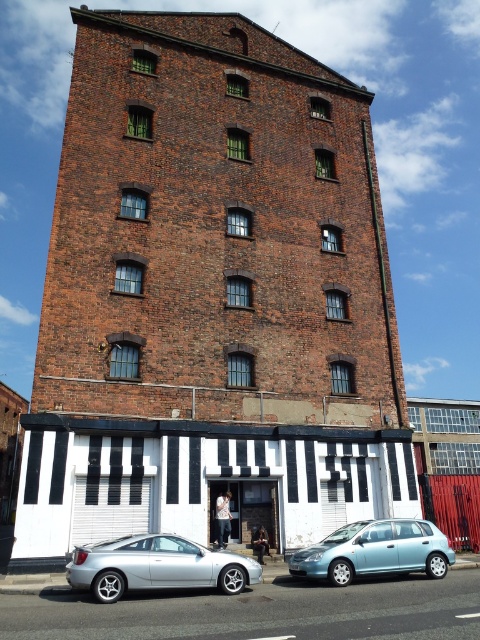
Question: Is silver metallic car at lower left bigger than light blue metallic hatchback at lower right?

Choices:
 (A) yes
 (B) no

Answer: (A)

Question: Is silver metallic car at lower left positioned before light blue metallic hatchback at lower right?

Choices:
 (A) no
 (B) yes

Answer: (B)

Question: Does silver metallic car at lower left have a greater width compared to light blue metallic hatchback at lower right?

Choices:
 (A) yes
 (B) no

Answer: (A)

Question: Which point appears farthest from the camera in this image?

Choices:
 (A) (134, 588)
 (B) (296, 552)

Answer: (B)

Question: Which of the following is the closest to the observer?

Choices:
 (A) (399, 518)
 (B) (257, 579)

Answer: (B)